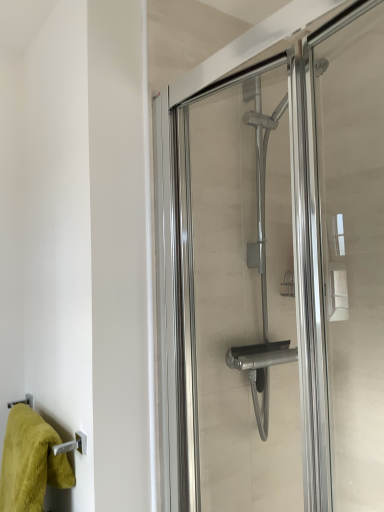
Question: Is green fluffy towel at lower left aimed at clear glass shower door at center?

Choices:
 (A) yes
 (B) no

Answer: (B)

Question: Does green fluffy towel at lower left have a lesser width compared to clear glass shower door at center?

Choices:
 (A) no
 (B) yes

Answer: (A)

Question: From a real-world perspective, is green fluffy towel at lower left positioned under clear glass shower door at center based on gravity?

Choices:
 (A) no
 (B) yes

Answer: (B)

Question: From the image's perspective, is green fluffy towel at lower left beneath clear glass shower door at center?

Choices:
 (A) yes
 (B) no

Answer: (A)

Question: Is clear glass shower door at center a part of green fluffy towel at lower left?

Choices:
 (A) no
 (B) yes

Answer: (A)

Question: Is green fluffy towel at lower left further to the viewer compared to clear glass shower door at center?

Choices:
 (A) yes
 (B) no

Answer: (A)

Question: Is clear glass shower door at center smaller than green fluffy towel at lower left?

Choices:
 (A) yes
 (B) no

Answer: (B)

Question: Is clear glass shower door at center next to green fluffy towel at lower left and touching it?

Choices:
 (A) no
 (B) yes

Answer: (A)

Question: Is clear glass shower door at center looking in the opposite direction of green fluffy towel at lower left?

Choices:
 (A) no
 (B) yes

Answer: (A)

Question: From a real-world perspective, is clear glass shower door at center on top of green fluffy towel at lower left?

Choices:
 (A) no
 (B) yes

Answer: (B)

Question: Does clear glass shower door at center have a greater width compared to green fluffy towel at lower left?

Choices:
 (A) yes
 (B) no

Answer: (B)

Question: Does clear glass shower door at center come behind green fluffy towel at lower left?

Choices:
 (A) no
 (B) yes

Answer: (A)

Question: Is clear glass shower door at center inside the boundaries of green fluffy towel at lower left, or outside?

Choices:
 (A) outside
 (B) inside

Answer: (A)